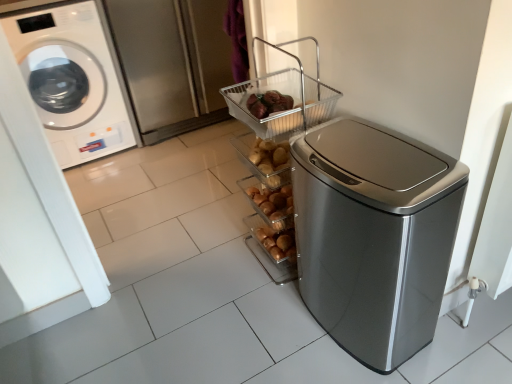
I want to click on free space on the front side of brushed metal screen door at upper left, so click(178, 165).